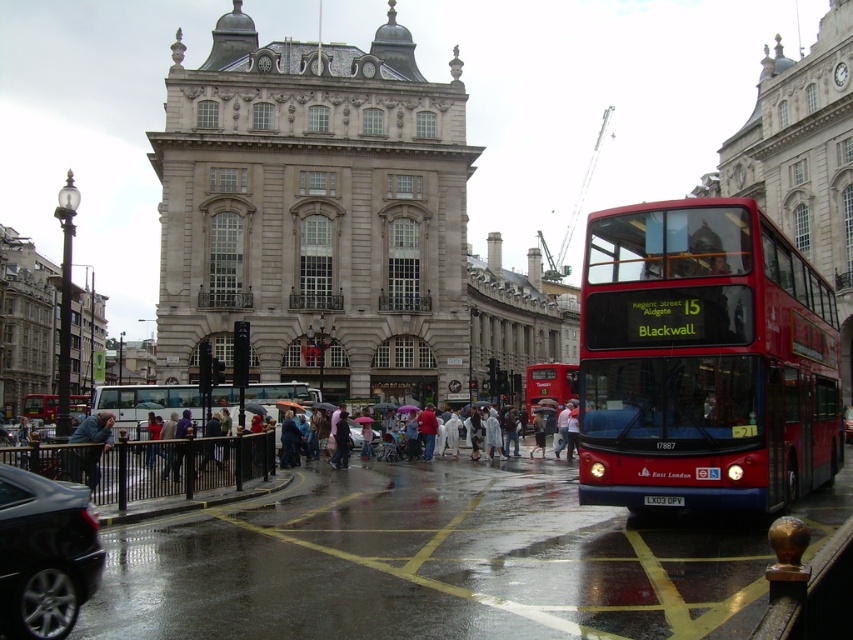
Question: Which object is farther from the camera taking this photo?

Choices:
 (A) shiny black car at lower left
 (B) blue denim jacket at lower left
 (C) red metallic bus at center

Answer: (B)

Question: Which object is farther from the camera taking this photo?

Choices:
 (A) shiny black car at lower left
 (B) matte white bus at center
 (C) red metallic bus at center
 (D) red rubber bus at center

Answer: (D)

Question: Is red rubber bus at center bigger than blue denim jacket at lower left?

Choices:
 (A) no
 (B) yes

Answer: (B)

Question: Which object appears farthest from the camera in this image?

Choices:
 (A) blue denim jacket at lower left
 (B) shiny black car at lower left
 (C) red rubber bus at center

Answer: (C)

Question: Does shiny black car at lower left have a lesser width compared to blue denim jacket at lower left?

Choices:
 (A) yes
 (B) no

Answer: (A)

Question: Can you confirm if red metallic bus at center is positioned above shiny black car at lower left?

Choices:
 (A) yes
 (B) no

Answer: (A)